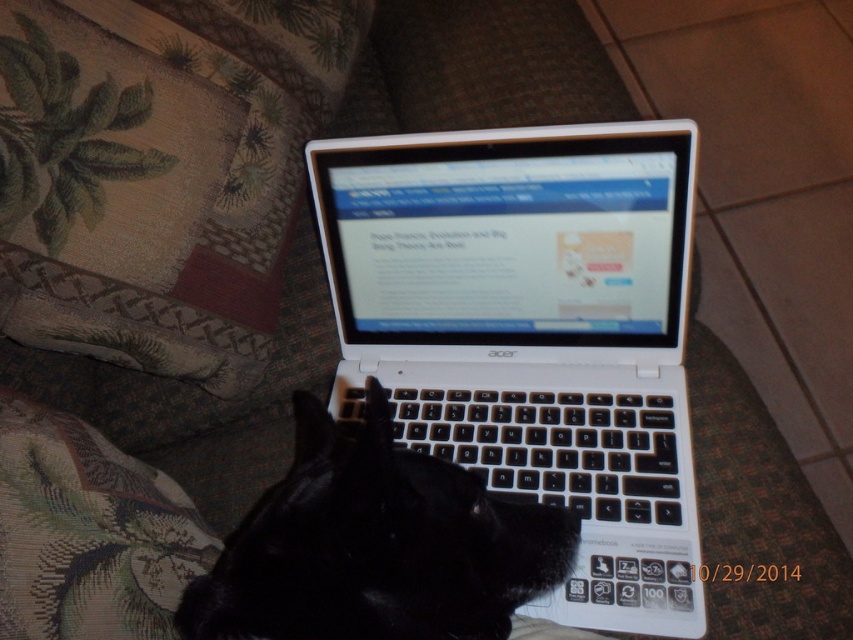
You are a delivery person trying to place a small package on the couch where both the white plastic laptop at center and the black fur cat at center are present. Can you fit the package between them without moving either object?

The white plastic laptop at center is bigger than the black fur cat at center, so there might not be enough space between them to place the package. Check the available gap carefully before attempting.

You are a photographer setting up a tripod to take a closeup shot of the white plastic laptop at center. The tripod has a maximum extension of 26 inches. Based on the scene description, will the tripod be able to reach the laptop without extending beyond its maximum height?

The distance between the white plastic laptop at center and the camera is 26.47 inches, which exceeds the tripod maximum extension of 26 inches. Therefore, the tripod cannot reach the laptop without extending beyond its limit.

You are trying to place a small plant pot on the couch next to the white plastic laptop at center. Based on the coordinates provided, can you determine if there is enough space for the plant pot?

The white plastic laptop at center is located at point (532, 333). Since the coordinates indicate its position on the couch, there might be enough space next to it for the plant pot, but the exact availability depends on the couch size and the pot dimensions not provided here.